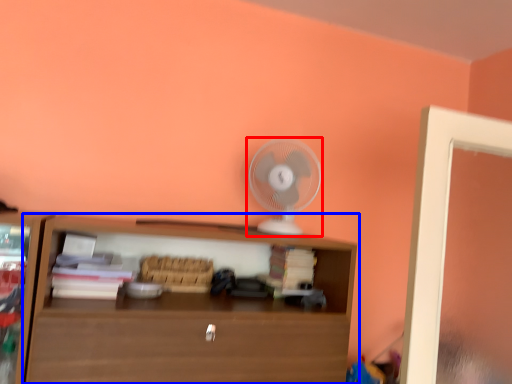
Question: Among these objects, which one is farthest to the camera, mechanical fan (highlighted by a red box) or shelf (highlighted by a blue box)?

Choices:
 (A) mechanical fan
 (B) shelf

Answer: (A)